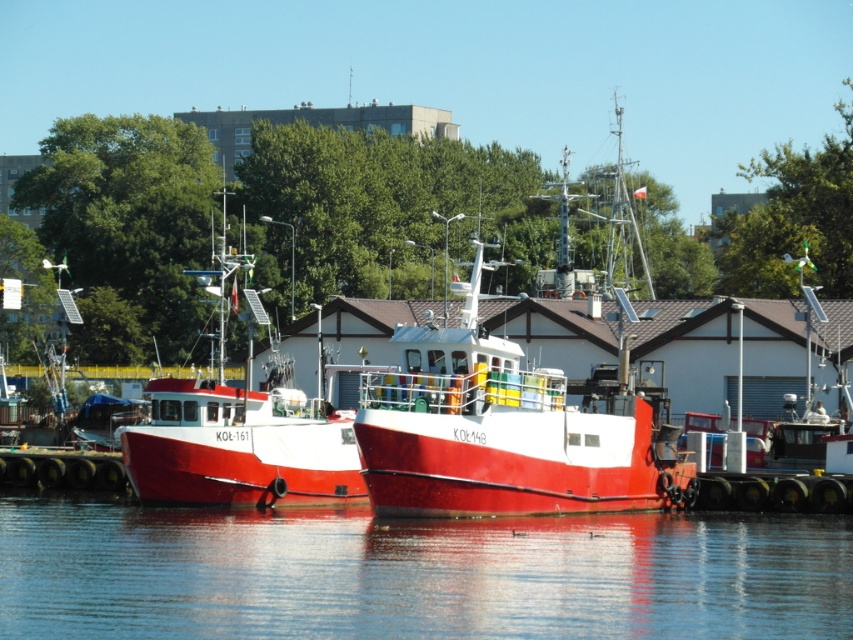
Question: Which of the following is the closest to the observer?

Choices:
 (A) shiny red boat at center
 (B) red matte boat at left
 (C) transparent water at center

Answer: (C)

Question: Among these objects, which one is farthest from the camera?

Choices:
 (A) red matte boat at left
 (B) shiny red boat at center

Answer: (A)

Question: Is transparent water at center positioned before shiny red boat at center?

Choices:
 (A) no
 (B) yes

Answer: (B)

Question: Does transparent water at center have a smaller size compared to red matte boat at left?

Choices:
 (A) no
 (B) yes

Answer: (B)

Question: Which point is farther to the camera?

Choices:
 (A) (271, 490)
 (B) (456, 340)

Answer: (A)

Question: Is shiny red boat at center thinner than red matte boat at left?

Choices:
 (A) yes
 (B) no

Answer: (B)